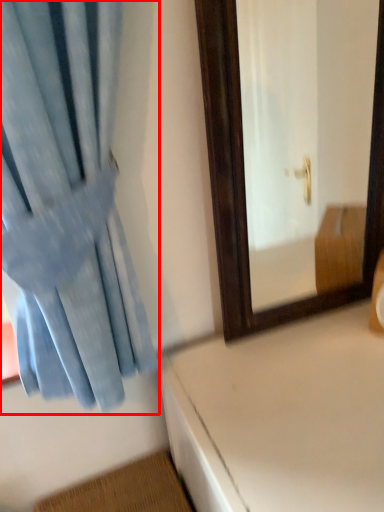
Question: Where is curtain (annotated by the red box) located in relation to table in the image?

Choices:
 (A) right
 (B) left

Answer: (B)